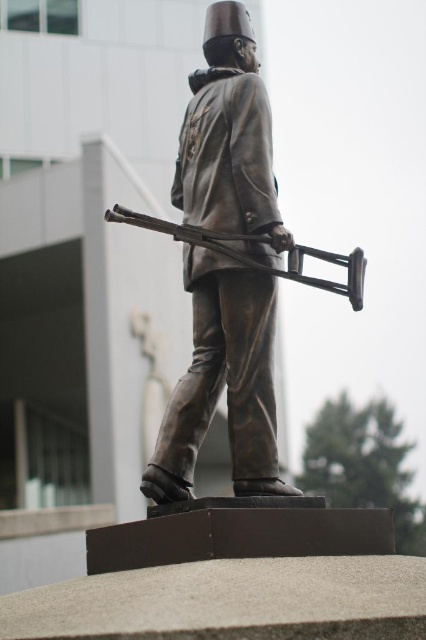
Question: Is bronze statue at center above bronze rifle at center?

Choices:
 (A) yes
 (B) no

Answer: (A)

Question: Among these points, which one is farthest from the camera?

Choices:
 (A) (232, 253)
 (B) (158, 477)

Answer: (A)

Question: Among these points, which one is farthest from the camera?

Choices:
 (A) (351, 301)
 (B) (161, 493)

Answer: (A)

Question: Is bronze statue at center wider than bronze rifle at center?

Choices:
 (A) yes
 (B) no

Answer: (B)

Question: Is bronze statue at center smaller than bronze rifle at center?

Choices:
 (A) no
 (B) yes

Answer: (A)